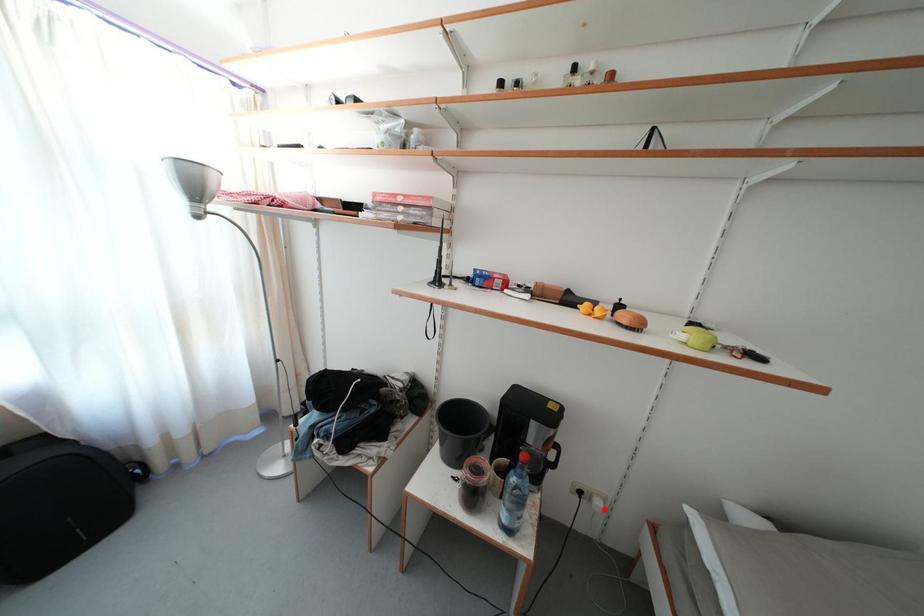
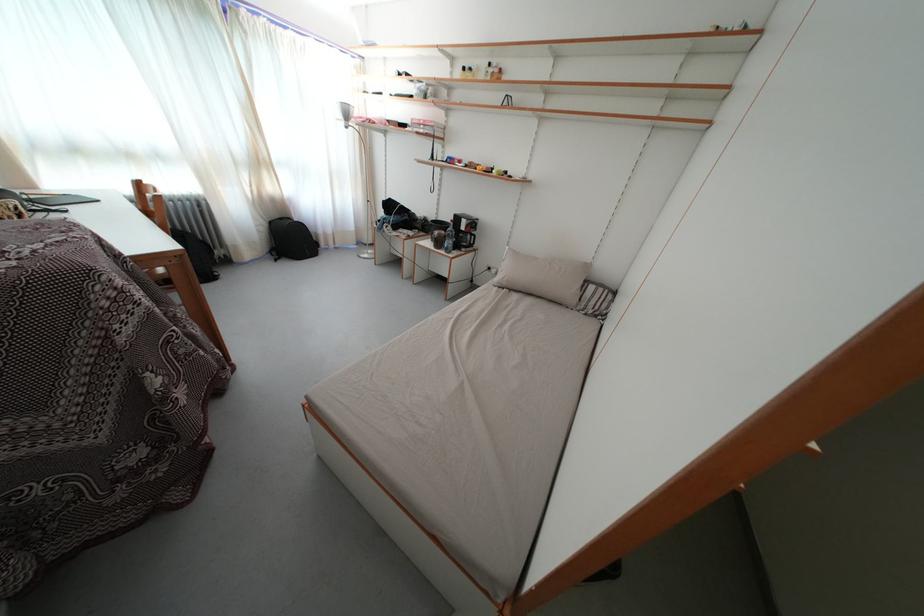
Where in the second image is the point corresponding to the highlighted location from the first image?

(500, 276)